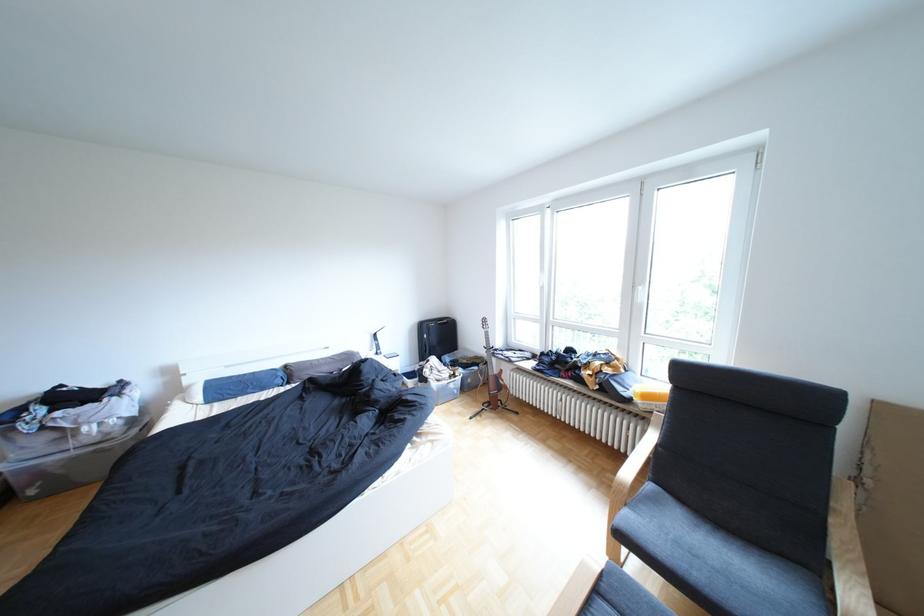
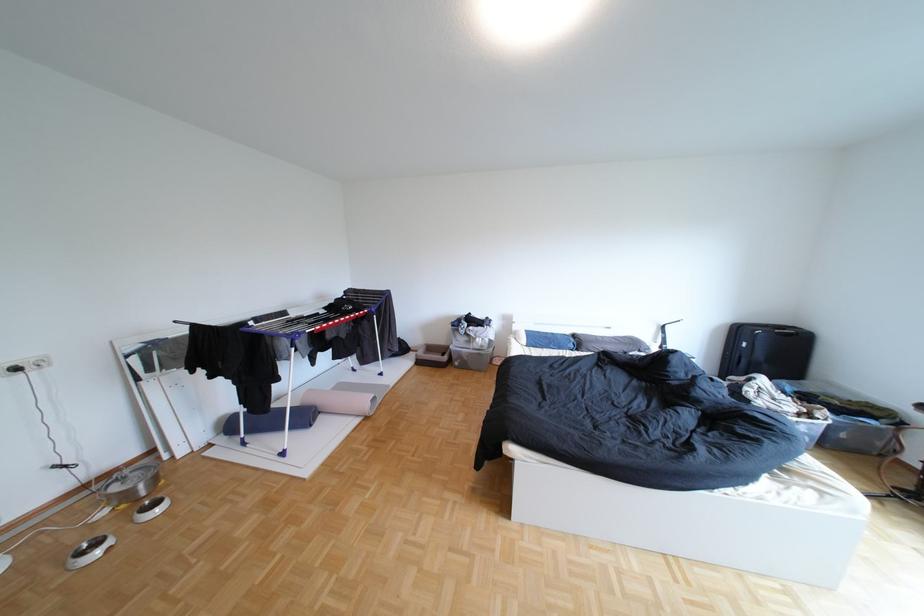
Question: How did the camera likely rotate?

Choices:
 (A) Left
 (B) Right
 (C) Up
 (D) Down

Answer: (A)